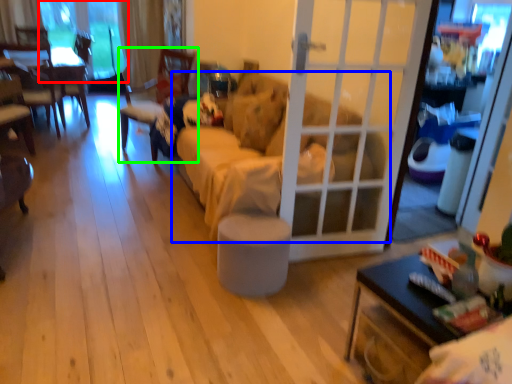
Question: Considering the real-world distances, which object is closest to window screen (highlighted by a red box)? studio couch (highlighted by a blue box) or chair (highlighted by a green box).

Choices:
 (A) studio couch
 (B) chair

Answer: (B)